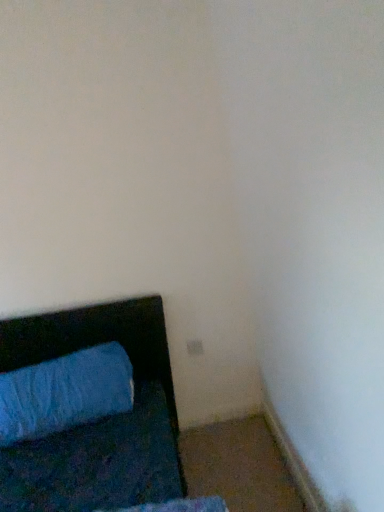
Question: Should I look upward or downward to see blue fabric pillow at lower left?

Choices:
 (A) down
 (B) up

Answer: (A)